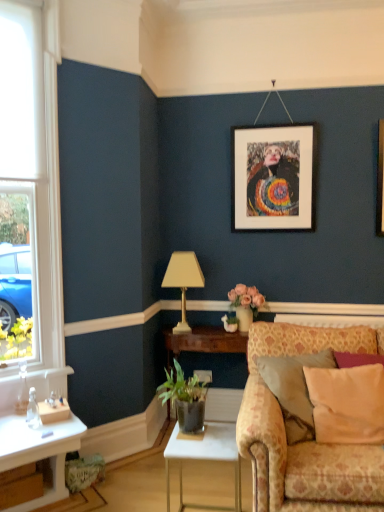
Image resolution: width=384 pixels, height=512 pixels. Identify the location of beige fabric pillow at right. click(x=347, y=404).

Locate an element on the screen. The height and width of the screenshot is (512, 384). white glossy table at center is located at coordinates (205, 459).

What is the approximate width of floral-patterned fabric couch at lower right?

It is 3.41 feet.

The image size is (384, 512). What do you see at coordinates (303, 442) in the screenshot?
I see `floral-patterned fabric couch at lower right` at bounding box center [303, 442].

I want to click on white matte picture frame at upper center, so click(x=272, y=178).

Locate an element on the screen. The image size is (384, 512). white wood window at left is located at coordinates (33, 185).

Measure the distance between point (23, 105) and camera.

Point (23, 105) is 2.33 meters away from camera.

Looking at this image, what is the approximate height of green leafy plant in terracotta pot at lower center?

green leafy plant in terracotta pot at lower center is 12.97 inches in height.

I want to click on beige fabric pillow at right, so click(x=347, y=404).

Is gold metallic table lamp at center in front of or behind white matte picture frame at upper center in the image?

Visually, gold metallic table lamp at center is located in front of white matte picture frame at upper center.

Can you confirm if gold metallic table lamp at center is shorter than white matte picture frame at upper center?

Correct, gold metallic table lamp at center is not as tall as white matte picture frame at upper center.

Considering the relative sizes of gold metallic table lamp at center and white matte picture frame at upper center in the image provided, is gold metallic table lamp at center wider than white matte picture frame at upper center?

Correct, the width of gold metallic table lamp at center exceeds that of white matte picture frame at upper center.

Is white matte picture frame at upper center located within gold metallic table lamp at center?

No, white matte picture frame at upper center is located outside of gold metallic table lamp at center.

Which object is thinner, floral-patterned fabric couch at lower right or white matte picture frame at upper center?

white matte picture frame at upper center.

Find the location of `picture frame on the left of floral-patterned fabric couch at lower right`. picture frame on the left of floral-patterned fabric couch at lower right is located at coordinates (272, 178).

Is floral-patterned fabric couch at lower right with white matte picture frame at upper center?

floral-patterned fabric couch at lower right and white matte picture frame at upper center are not in contact.

How far apart are floral-patterned fabric couch at lower right and gold metallic table lamp at center?

A distance of 1.03 meters exists between floral-patterned fabric couch at lower right and gold metallic table lamp at center.

From a real-world perspective, is floral-patterned fabric couch at lower right positioned under gold metallic table lamp at center based on gravity?

Correct, in the physical world, floral-patterned fabric couch at lower right is lower than gold metallic table lamp at center.

Is floral-patterned fabric couch at lower right wider or thinner than gold metallic table lamp at center?

Considering their sizes, floral-patterned fabric couch at lower right looks broader than gold metallic table lamp at center.

Is beige fabric pillow at right not near gold metallic table lamp at center?

Yes, beige fabric pillow at right and gold metallic table lamp at center are located far from each other.

Is beige fabric pillow at right inside the boundaries of gold metallic table lamp at center, or outside?

beige fabric pillow at right is spatially situated outside gold metallic table lamp at center.

Considering the sizes of objects beige fabric pillow at right and gold metallic table lamp at center in the image provided, who is taller, beige fabric pillow at right or gold metallic table lamp at center?

gold metallic table lamp at center is taller.

Is white matte picture frame at upper center wider than white wood window at left?

No.

Consider the image. Is white wood window at left completely or partially inside white matte picture frame at upper center?

Definitely not — white wood window at left is not inside white matte picture frame at upper center.

Is white matte picture frame at upper center far from white wood window at left?

Yes.

Considering the positions of points (372, 375) and (240, 440), is point (372, 375) closer to camera compared to point (240, 440)?

No, it is not.

Who is smaller, beige fabric pillow at right or floral-patterned fabric couch at lower right?

Smaller between the two is beige fabric pillow at right.

Who is more distant, beige fabric pillow at right or floral-patterned fabric couch at lower right?

beige fabric pillow at right is more distant.

Can you tell me how much green leafy plant in terracotta pot at lower center and white glossy table at center differ in facing direction?

0.572 degrees separate the facing orientations of green leafy plant in terracotta pot at lower center and white glossy table at center.

Which of these two, green leafy plant in terracotta pot at lower center or white glossy table at center, is thinner?

With smaller width is green leafy plant in terracotta pot at lower center.

Is green leafy plant in terracotta pot at lower center taller or shorter than white glossy table at center?

Clearly, green leafy plant in terracotta pot at lower center is shorter compared to white glossy table at center.

Where is `table that is under the green leafy plant in terracotta pot at lower center (from a real-world perspective)`? table that is under the green leafy plant in terracotta pot at lower center (from a real-world perspective) is located at coordinates (205, 459).

Locate an element on the screen. The width and height of the screenshot is (384, 512). table lamp in front of the white matte picture frame at upper center is located at coordinates (183, 281).

Identify the location of studio couch lying on the right of white matte picture frame at upper center. (303, 442).

Looking at the image, which one is located closer to white wood window at left, beige fabric pillow at right or white matte picture frame at upper center?

white matte picture frame at upper center.

Considering their positions, is white glossy table at center positioned further to beige fabric pillow at right than floral-patterned fabric couch at lower right?

white glossy table at center is further to beige fabric pillow at right.

From the image, which object appears to be nearer to white glossy table at center, green leafy plant in terracotta pot at lower center or gold metallic table lamp at center?

green leafy plant in terracotta pot at lower center lies closer to white glossy table at center than the other object.

Looking at the image, which one is located closer to green leafy plant in terracotta pot at lower center, white glossy table at center or white matte picture frame at upper center?

The object closer to green leafy plant in terracotta pot at lower center is white glossy table at center.

Based on their spatial positions, is white glossy table at center or white wood window at left closer to floral-patterned fabric couch at lower right?

white glossy table at center is positioned closer to the anchor floral-patterned fabric couch at lower right.

Considering their positions, is green leafy plant in terracotta pot at lower center positioned further to white glossy table at center than beige fabric pillow at right?

beige fabric pillow at right.

Which object lies further to the anchor point green leafy plant in terracotta pot at lower center, beige fabric pillow at right or white wood window at left?

The object further to green leafy plant in terracotta pot at lower center is white wood window at left.

From the image, which object appears to be farther from white matte picture frame at upper center, green leafy plant in terracotta pot at lower center or floral-patterned fabric couch at lower right?

green leafy plant in terracotta pot at lower center lies further to white matte picture frame at upper center than the other object.

Image resolution: width=384 pixels, height=512 pixels. Identify the location of houseplant located between white wood window at left and beige fabric pillow at right in the left-right direction. (185, 398).

The image size is (384, 512). I want to click on studio couch located between white wood window at left and beige fabric pillow at right in the left-right direction, so click(303, 442).

What are the coordinates of `studio couch between green leafy plant in terracotta pot at lower center and beige fabric pillow at right in the horizontal direction` in the screenshot? It's located at (303, 442).

Locate an element on the screen. houseplant between white matte picture frame at upper center and white glossy table at center vertically is located at coordinates (185, 398).